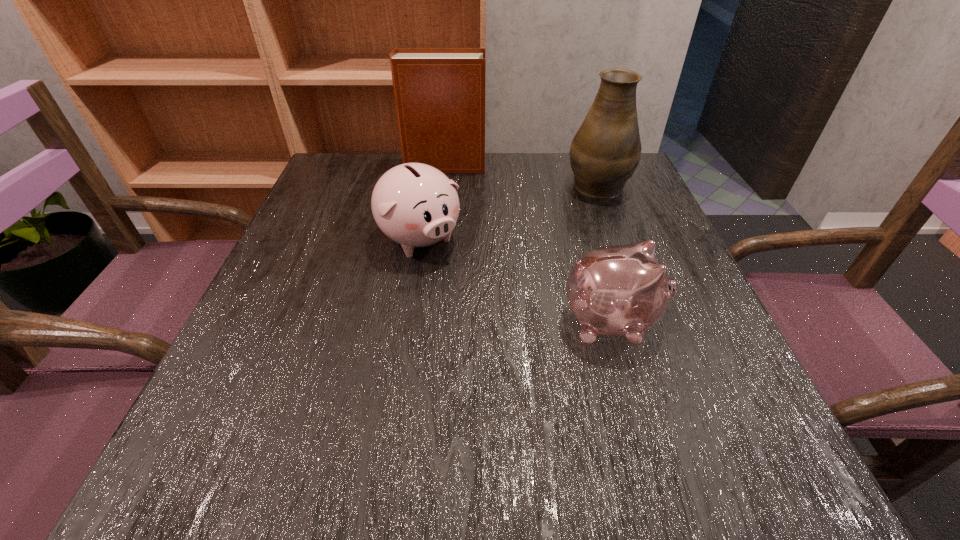
Image resolution: width=960 pixels, height=540 pixels. Identify the location of vacant point that satisfies the following two spatial constraints: 1. on the handle side of the pitcher; 2. on the open cover of the hardback book. (591, 166).

You are a GUI agent. You are given a task and a screenshot of the screen. Output one action in this format:
    pyautogui.click(x=<x>, y=<y>)
    Task: Click on the free space that satisfies the following two spatial constraints: 1. on the open cover of the hardback book; 2. on the handle side of the pitcher
    The height and width of the screenshot is (540, 960).
    Given the screenshot: What is the action you would take?
    tap(443, 183)

This screenshot has width=960, height=540. What are the coordinates of `free region that satisfies the following two spatial constraints: 1. on the front facing side of the right piggy bank; 2. on the open cover of the hardback book` in the screenshot? It's located at (566, 166).

This screenshot has height=540, width=960. What are the coordinates of `vacant position in the image that satisfies the following two spatial constraints: 1. on the handle side of the pitcher; 2. on the open cover of the hardback book` in the screenshot? It's located at (591, 166).

Identify the location of vacant area that satisfies the following two spatial constraints: 1. on the front facing side of the right piggy bank; 2. on the handle side of the pitcher. This screenshot has height=540, width=960. (571, 183).